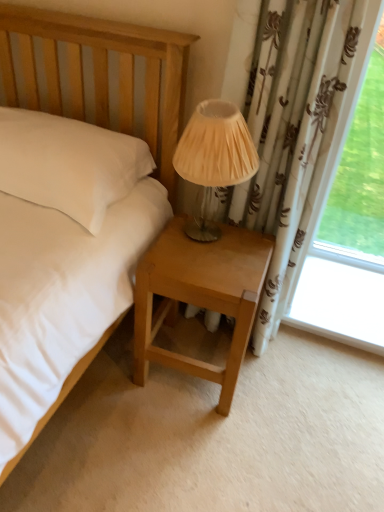
The height and width of the screenshot is (512, 384). Identify the location of free spot below matte beige fabric lampshade at center (from a real-world perspective). (201, 229).